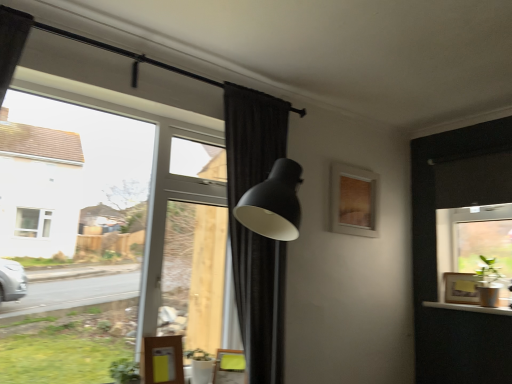
Locate an element on the screen. The image size is (512, 384). wooden picture frame at right, the 1th picture frame positioned from the right is located at coordinates [461, 288].

The height and width of the screenshot is (384, 512). In order to click on green matte plant at right in this screenshot , I will do `click(488, 283)`.

Describe the element at coordinates (354, 201) in the screenshot. The image size is (512, 384). I see `wooden frame at upper right, arranged as the first picture frame when viewed from the top` at that location.

Where is `white glossy window sill at lower right`? The width and height of the screenshot is (512, 384). white glossy window sill at lower right is located at coordinates (469, 308).

What do you see at coordinates (103, 237) in the screenshot? I see `transparent glass window at upper left, the 1th window when ordered from left to right` at bounding box center [103, 237].

Find the location of a particular element. yellow wood door at lower left is located at coordinates (163, 360).

Where is `green matte plant at lower left`? The image size is (512, 384). green matte plant at lower left is located at coordinates (125, 371).

The width and height of the screenshot is (512, 384). What do you see at coordinates (254, 233) in the screenshot?
I see `black matte curtain at center` at bounding box center [254, 233].

Locate an element on the screen. The width and height of the screenshot is (512, 384). wooden picture frame at right, the 1th picture frame positioned from the right is located at coordinates [461, 288].

Which of these two, green matte plant at right or white glossy window sill at lower right, is smaller?

white glossy window sill at lower right.

Would you say green matte plant at right is inside or outside white glossy window sill at lower right?

green matte plant at right is not enclosed by white glossy window sill at lower right.

Find the location of `window sill located underneath the green matte plant at right (from a real-world perspective)`. window sill located underneath the green matte plant at right (from a real-world perspective) is located at coordinates (469, 308).

Does point (492, 260) come closer to viewer compared to point (496, 308)?

No, it is behind (496, 308).

From the image's perspective, is yellow wood door at lower left over white glossy window sill at lower right?

No.

Considering the relative positions of yellow wood door at lower left and white glossy window sill at lower right in the image provided, is yellow wood door at lower left to the left of white glossy window sill at lower right from the viewer's perspective?

Yes, yellow wood door at lower left is to the left of white glossy window sill at lower right.

Locate an element on the screen. furniture located below the white glossy window sill at lower right (from the image's perspective) is located at coordinates (163, 360).

Is yellow wood door at lower left turned away from white glossy window sill at lower right?

yellow wood door at lower left is not turned away from white glossy window sill at lower right.

Would you say green matte plant at lower left is to the left or to the right of white glossy window sill at lower right in the picture?

In the image, green matte plant at lower left appears on the left side of white glossy window sill at lower right.

I want to click on window sill on the right of green matte plant at lower left, so click(469, 308).

Is green matte plant at lower left further to camera compared to white glossy window sill at lower right?

No, green matte plant at lower left is in front of white glossy window sill at lower right.

Between point (123, 366) and point (469, 308), which one is positioned behind?

The point (469, 308) is farther from the camera.

Is wooden picture frame at right, which is counted as the 2th picture frame, starting from the left, bigger or smaller than green matte plant at lower left?

wooden picture frame at right, which is counted as the 2th picture frame, starting from the left, is bigger than green matte plant at lower left.

Is wooden picture frame at right, the 1th picture frame positioned from the right, surrounding green matte plant at lower left?

No.

From a real-world perspective, between wooden picture frame at right, the 1th picture frame positioned from the right, and green matte plant at lower left, who is vertically higher?

wooden picture frame at right, the 1th picture frame positioned from the right, from a real-world perspective.

Is wooden picture frame at right, which appears as the 1th picture frame when ordered from the bottom, in front of or behind green matte plant at lower left in the image?

wooden picture frame at right, which appears as the 1th picture frame when ordered from the bottom, is positioned farther from the viewer than green matte plant at lower left.

How different are the orientations of clear glass window at right, the 2th window in the left-to-right sequence, and green matte plant at lower left in degrees?

There is a 91.3-degree angle between the facing directions of clear glass window at right, the 2th window in the left-to-right sequence, and green matte plant at lower left.

Is clear glass window at right, the 2th window in the left-to-right sequence, not close to green matte plant at lower left?

Absolutely, clear glass window at right, the 2th window in the left-to-right sequence, is distant from green matte plant at lower left.

You are a GUI agent. You are given a task and a screenshot of the screen. Output one action in this format:
    pyautogui.click(x=<x>, y=<y>)
    Task: Click on the plant on the left side of clear glass window at right, the 2th window in the left-to-right sequence
    
    Given the screenshot: What is the action you would take?
    pyautogui.click(x=125, y=371)

Could you tell me if clear glass window at right, the 2th window in the left-to-right sequence, is turned towards green matte plant at lower left?

Yes, clear glass window at right, the 2th window in the left-to-right sequence, is turned towards green matte plant at lower left.

Considering the sizes of objects yellow wood door at lower left and clear glass window at right, the 2th window in the left-to-right sequence, in the image provided, who is smaller, yellow wood door at lower left or clear glass window at right, the 2th window in the left-to-right sequence,?

yellow wood door at lower left.

Is yellow wood door at lower left turned away from clear glass window at right, the 2th window in the left-to-right sequence?

No, yellow wood door at lower left is not facing the opposite direction of clear glass window at right, the 2th window in the left-to-right sequence.

From the image's perspective, is yellow wood door at lower left below clear glass window at right, which is the first window in right-to-left order?

Correct, yellow wood door at lower left appears lower than clear glass window at right, which is the first window in right-to-left order, in the image.

In the scene shown: Who is shorter, black matte curtain at center or green matte plant at right?

Standing shorter between the two is green matte plant at right.

What's the angular difference between black matte curtain at center and green matte plant at right's facing directions?

black matte curtain at center and green matte plant at right are facing 91.3 degrees away from each other.

Find the location of `houseplant that is under the black matte curtain at center (from a real-world perspective)`. houseplant that is under the black matte curtain at center (from a real-world perspective) is located at coordinates (488, 283).

Is green matte plant at right located within black matte curtain at center?

No.

Find the location of a particular element. The image size is (512, 384). houseplant above the white glossy window sill at lower right (from the image's perspective) is located at coordinates (488, 283).

Image resolution: width=512 pixels, height=384 pixels. I want to click on furniture that is on the left side of white glossy window sill at lower right, so [163, 360].

Estimate the real-world distances between objects in this image. Which object is further from wooden picture frame at right, the 2th picture frame positioned from the top, black matte curtain at center or wooden frame at upper right, which is counted as the 2th picture frame, starting from the bottom?

The object further to wooden picture frame at right, the 2th picture frame positioned from the top, is black matte curtain at center.

Considering their positions, is yellow wood door at lower left positioned further to yellow fabric swivel chair at lower center than white glossy window sill at lower right?

The object further to yellow fabric swivel chair at lower center is white glossy window sill at lower right.

Based on their spatial positions, is yellow wood door at lower left or green matte plant at right closer to transparent glass window at upper left, the 1th window when ordered from left to right?

Based on the image, yellow wood door at lower left appears to be nearer to transparent glass window at upper left, the 1th window when ordered from left to right.

From the image, which object appears to be farther from black matte curtain at center, clear glass window at right, which is the first window in right-to-left order, or yellow wood door at lower left?

clear glass window at right, which is the first window in right-to-left order, lies further to black matte curtain at center than the other object.

From the image, which object appears to be farther from black matte curtain at center, wooden frame at upper right, arranged as the first picture frame when viewed from the top, or green matte plant at lower left?

Based on the image, green matte plant at lower left appears to be further to black matte curtain at center.

Estimate the real-world distances between objects in this image. Which object is further from wooden picture frame at right, the 1th picture frame positioned from the right, transparent glass window at upper left, which is counted as the 2th window, starting from the right, or white glossy window sill at lower right?

Among the two, transparent glass window at upper left, which is counted as the 2th window, starting from the right, is located further to wooden picture frame at right, the 1th picture frame positioned from the right.

From the image, which object appears to be nearer to clear glass window at right, which is the first window in right-to-left order, green matte plant at lower left or white glossy window sill at lower right?

white glossy window sill at lower right lies closer to clear glass window at right, which is the first window in right-to-left order, than the other object.

Estimate the real-world distances between objects in this image. Which object is further from green matte plant at lower left, transparent glass window at upper left, the 1th window when ordered from left to right, or yellow wood door at lower left?

Based on the image, transparent glass window at upper left, the 1th window when ordered from left to right, appears to be further to green matte plant at lower left.

This screenshot has width=512, height=384. I want to click on plant situated between transparent glass window at upper left, which is counted as the 2th window, starting from the right, and clear glass window at right, which is the first window in right-to-left order, from left to right, so click(125, 371).

Where is `curtain between yellow fabric swivel chair at lower center and white glossy window sill at lower right`? Image resolution: width=512 pixels, height=384 pixels. curtain between yellow fabric swivel chair at lower center and white glossy window sill at lower right is located at coordinates (254, 233).

Identify the location of furniture between green matte plant at lower left and white glossy window sill at lower right in the horizontal direction. The width and height of the screenshot is (512, 384). coord(163,360).

You are a GUI agent. You are given a task and a screenshot of the screen. Output one action in this format:
    pyautogui.click(x=<x>, y=<y>)
    Task: Click on the furniture between black matte curtain at center and yellow fabric swivel chair at lower center from top to bottom
    Image resolution: width=512 pixels, height=384 pixels.
    Given the screenshot: What is the action you would take?
    pyautogui.click(x=163, y=360)